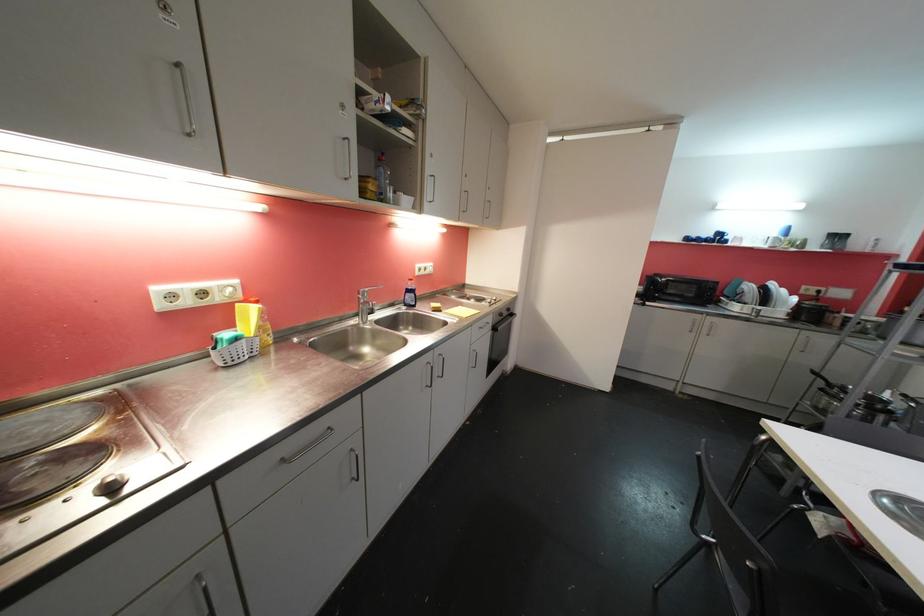
Locate an element on the screen. The image size is (924, 616). microwave door handle is located at coordinates (186, 99).